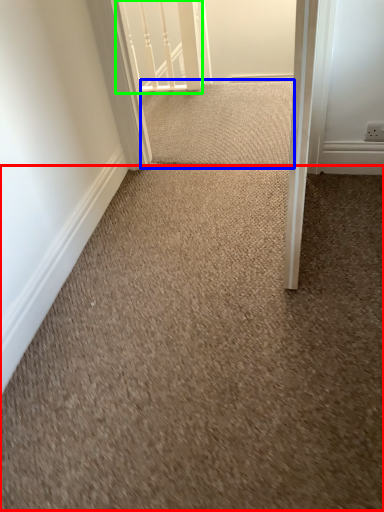
Question: Considering the real-world distances, which object is closest to granite (highlighted by a red box)? doormat (highlighted by a blue box) or rail (highlighted by a green box).

Choices:
 (A) doormat
 (B) rail

Answer: (A)